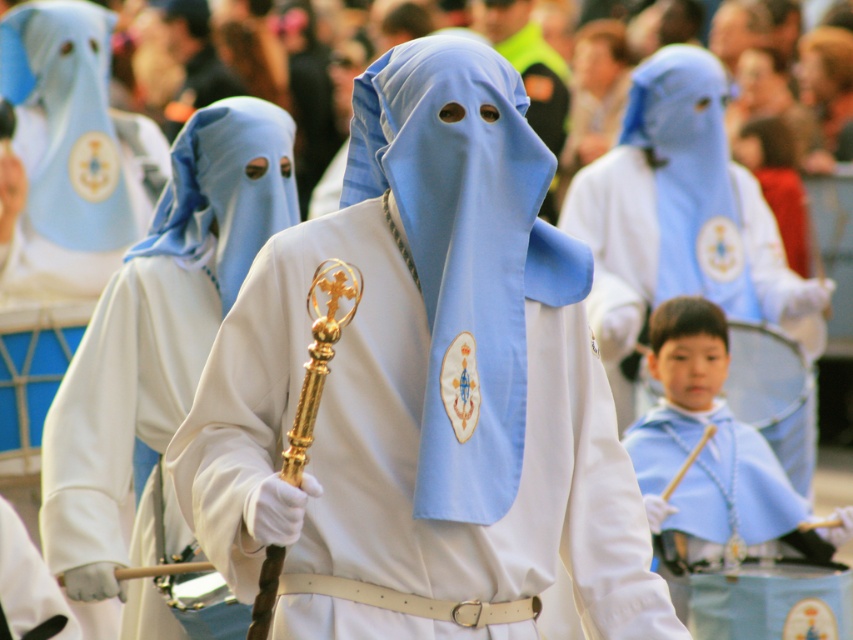
You are an observer at the religious procession. You notice the matte white robe at center and the matte blue fabric at center. Which object is positioned higher in the image?

The matte white robe at center is taller than the matte blue fabric at center, so the matte white robe at center is positioned higher in the image.

You are standing at the point with coordinates point (51, 16) and want to move towards the central figure holding the golden staff. Which direction should you move to reach the point (55, 445)?

You should move forward because point (55, 445) is in front of point (51, 16).